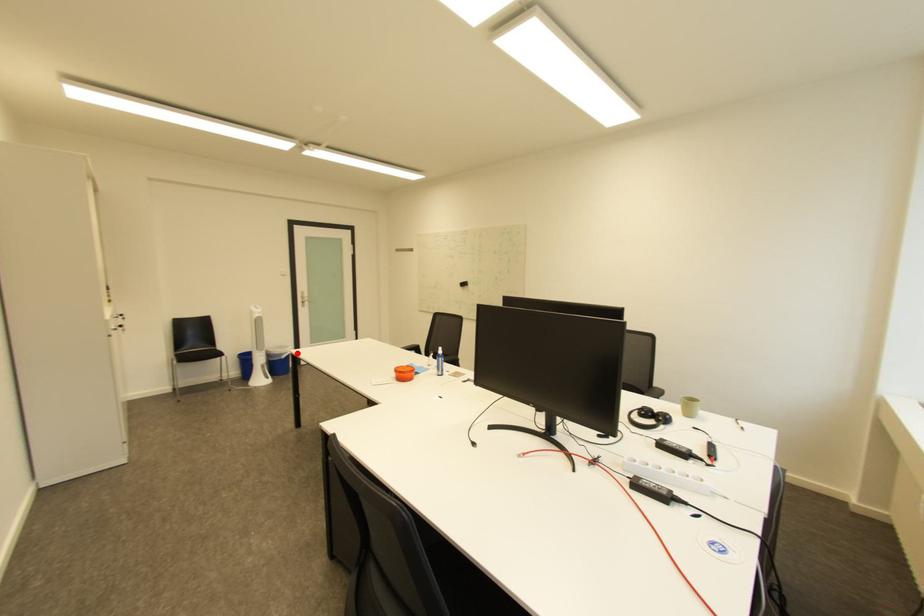
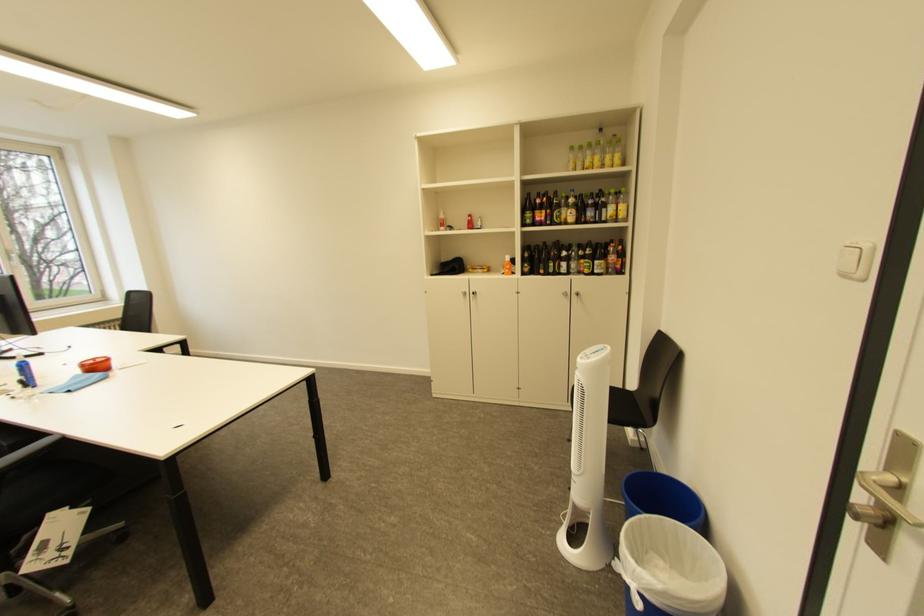
In the second image, find the point that corresponds to the highlighted location in the first image.

(636, 570)